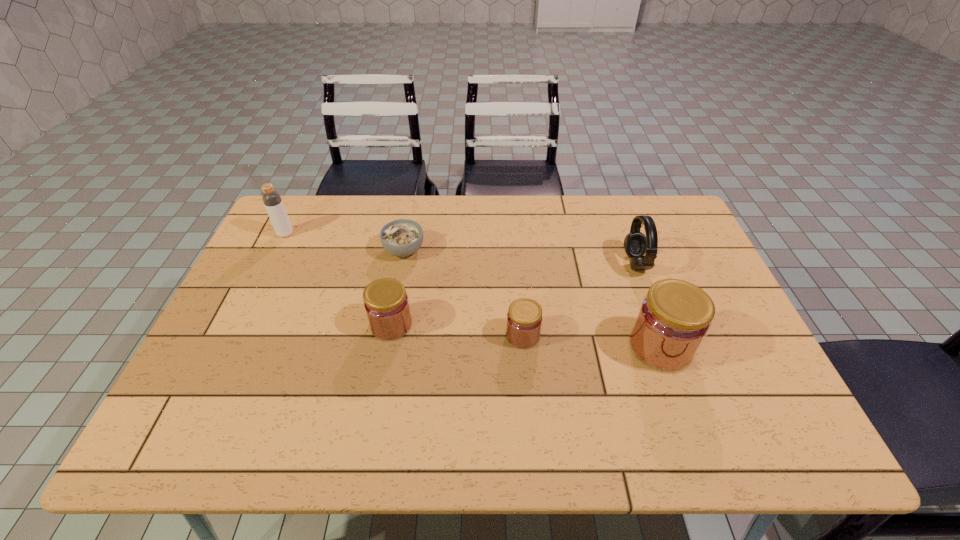
Where is `the fourth tallest object`? the fourth tallest object is located at coordinates tap(386, 303).

Locate an element on the screen. This screenshot has width=960, height=540. the second shortest jam is located at coordinates (386, 303).

Where is `the fourth object from left to right`? Image resolution: width=960 pixels, height=540 pixels. the fourth object from left to right is located at coordinates (524, 318).

Locate an element on the screen. The height and width of the screenshot is (540, 960). the shortest jam is located at coordinates (524, 318).

Image resolution: width=960 pixels, height=540 pixels. I want to click on the rightmost jam, so click(x=674, y=318).

This screenshot has width=960, height=540. I want to click on headset, so tap(636, 244).

Find the location of a particular element. soup bowl is located at coordinates (403, 237).

Where is `the leftmost object`? The height and width of the screenshot is (540, 960). the leftmost object is located at coordinates (271, 198).

Find the location of `free spot located 0.300m on the left of the third shortest object`. free spot located 0.300m on the left of the third shortest object is located at coordinates pyautogui.click(x=255, y=325).

Identify the location of free space located 0.110m on the front of the second shortest object. (527, 389).